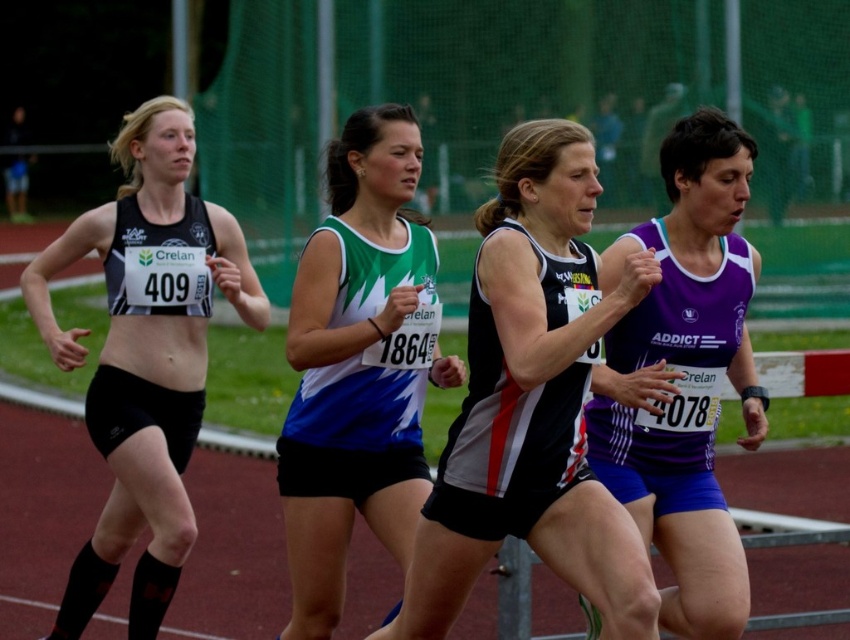
You are a photographer positioned on the side of the track. You want to capture a photo of the green and white jersey at center without the matte black tank top at left blocking it. What should you do?

The green and white jersey at center is behind the matte black tank top at left, so you should move to a position where the green and white jersey at center is in front of the matte black tank top at left to avoid obstruction.

You are a photographer trying to capture the best angle for the race. You notice two points marked in the image at coordinates point (452, 548) and point (601, 404). Which point is closer to your camera lens?

Point (452, 548) is closer to the camera lens than point (601, 404).